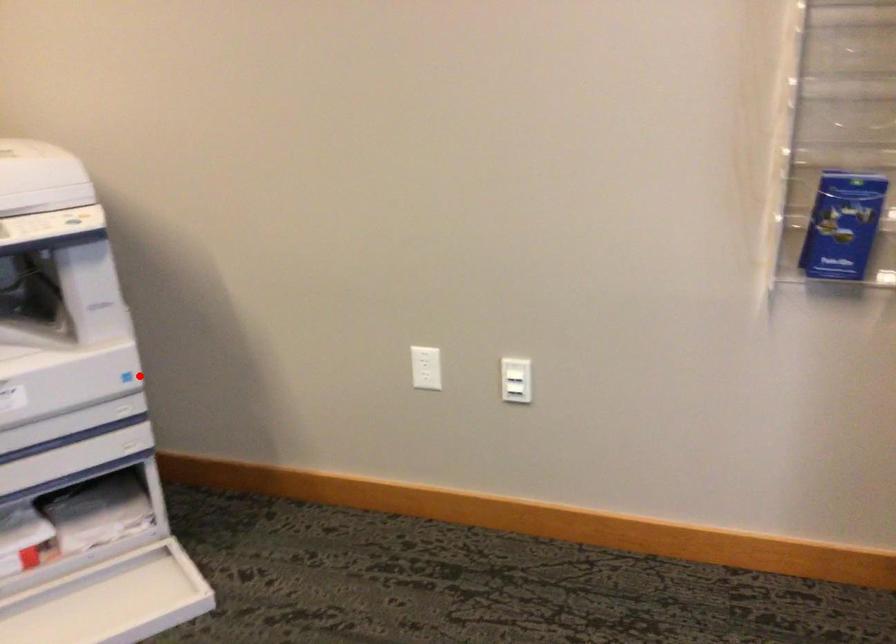
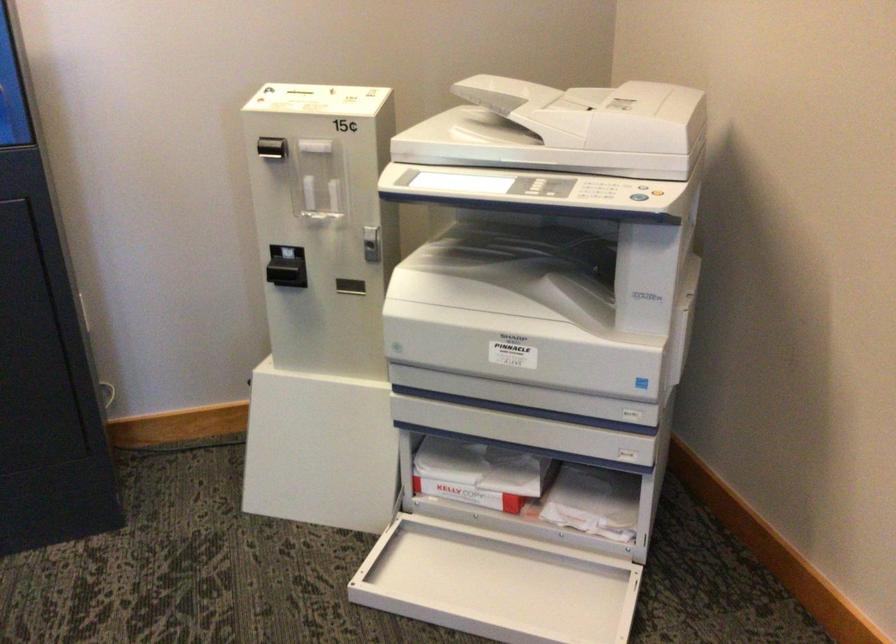
Question: A red point is marked in image1. In image2, is the corresponding 3D point closer to the camera or farther? Reply with the corresponding letter.

Choices:
 (A) The corresponding 3D point is closer.
 (B) The corresponding 3D point is farther.

Answer: (A)